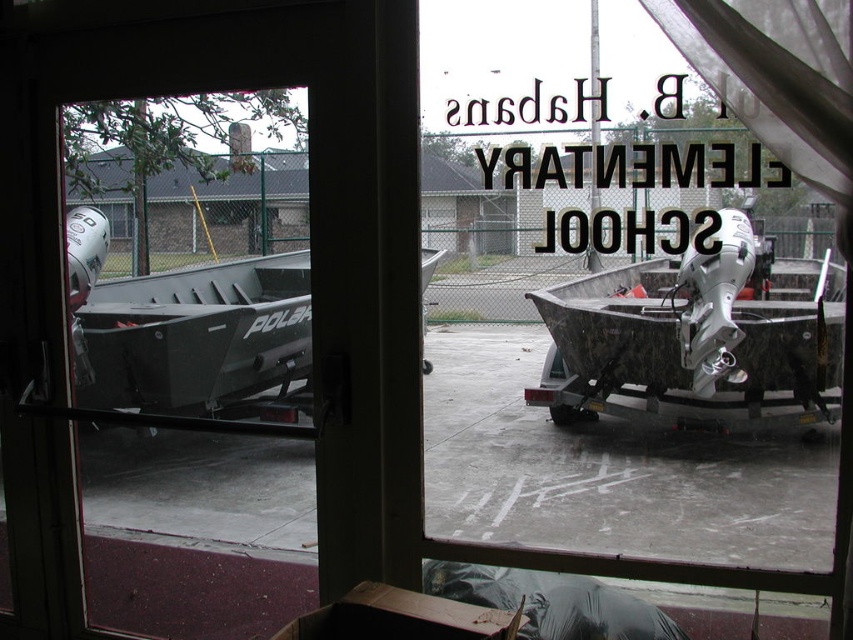
Question: Which of the following is the farthest from the observer?

Choices:
 (A) matte gray boat at left
 (B) transparent glass door at center

Answer: (B)

Question: Is rusty metal boat at right to the right of matte gray boat at left from the viewer's perspective?

Choices:
 (A) no
 (B) yes

Answer: (B)

Question: Is transparent glass door at center further to the viewer compared to matte gray boat at left?

Choices:
 (A) yes
 (B) no

Answer: (A)

Question: Where is transparent glass door at center located in relation to rusty metal boat at right in the image?

Choices:
 (A) above
 (B) below

Answer: (B)

Question: Which of the following is the farthest from the observer?

Choices:
 (A) (509, 554)
 (B) (254, 285)

Answer: (B)

Question: Which point is farther to the camera?

Choices:
 (A) transparent glass door at center
 (B) rusty metal boat at right

Answer: (A)